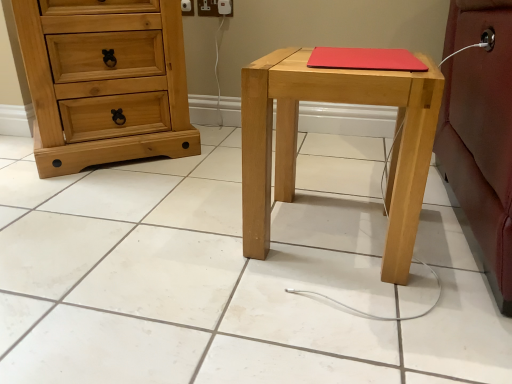
Find the location of a particular element. free area in between natural wood chest of drawers at left and natural wood stool at center is located at coordinates (192, 186).